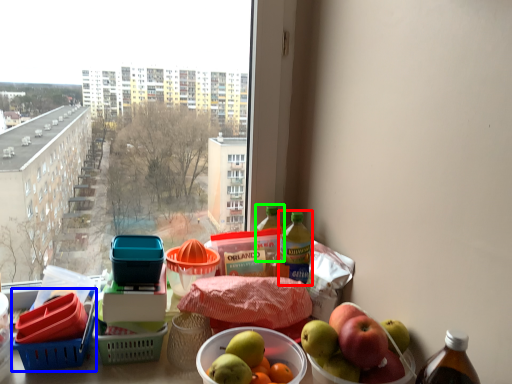
Question: Estimate the real-world distances between objects in this image. Which object is closer to bottle (highlighted by a red box), basket (highlighted by a blue box) or bottle (highlighted by a green box)?

Choices:
 (A) basket
 (B) bottle

Answer: (B)